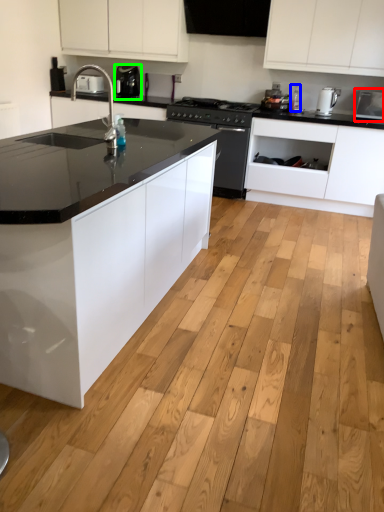
Question: Which object is positioned farthest from appliance (highlighted by a red box)? Select from bottle (highlighted by a blue box) and kitchen appliance (highlighted by a green box).

Choices:
 (A) bottle
 (B) kitchen appliance

Answer: (B)